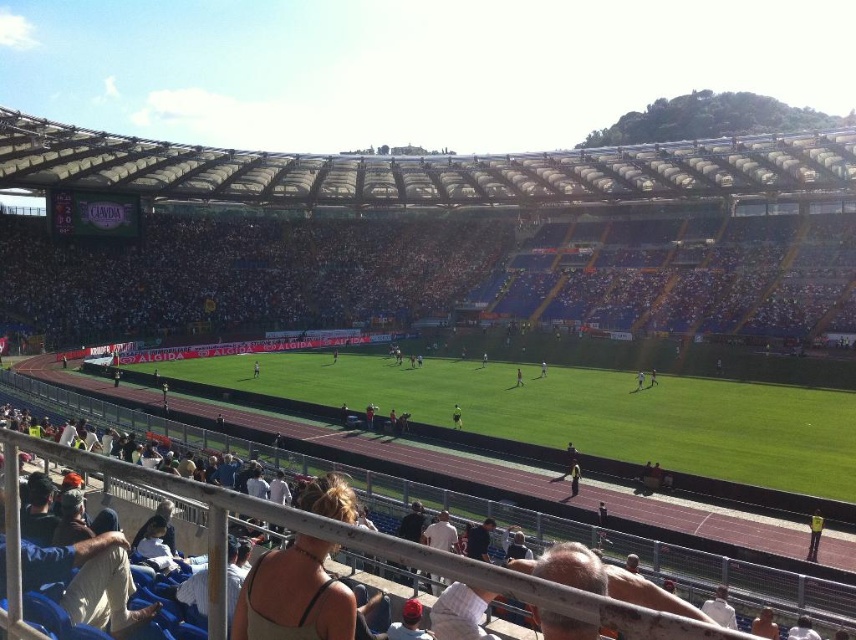
Question: Which object is positioned farthest from the light brown leather jacket at center?

Choices:
 (A) beige fabric tank top at lower center
 (B) light blue jersey at center
 (C) yellow fabric at lower right

Answer: (A)

Question: Which point is farther from the camera taking this photo?

Choices:
 (A) (305, 628)
 (B) (577, 486)

Answer: (B)

Question: In this image, where is dark gray track at lower center located relative to white fabric person at center?

Choices:
 (A) above
 (B) below

Answer: (B)

Question: Which of the following is the closest to the observer?

Choices:
 (A) light brown leather jacket at center
 (B) dark blue seats at center

Answer: (A)

Question: Can you confirm if dark blue seats at center is bigger than light blue jersey at center?

Choices:
 (A) yes
 (B) no

Answer: (A)

Question: Does dark blue seats at center have a greater width compared to dark gray track at lower center?

Choices:
 (A) yes
 (B) no

Answer: (A)